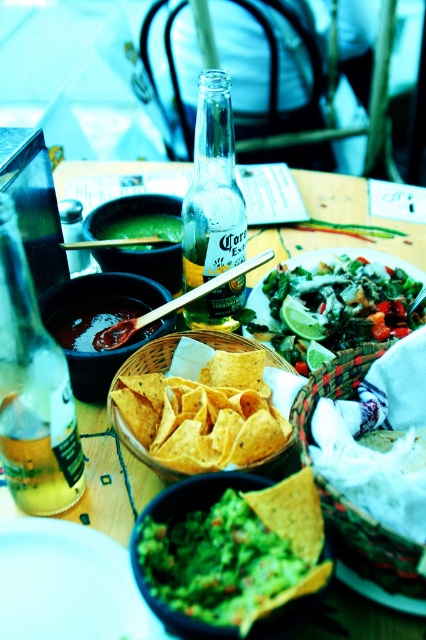
Question: Which object is closer to the camera taking this photo?

Choices:
 (A) braided straw basket at center
 (B) green creamy guacamole at center

Answer: (B)

Question: Is braided straw basket at center below matte green bowl at center?

Choices:
 (A) yes
 (B) no

Answer: (A)

Question: Is braided straw basket at center closer to camera compared to green matte lime at center?

Choices:
 (A) yes
 (B) no

Answer: (A)

Question: Which point is farther from the camera taking this photo?

Choices:
 (A) (178, 241)
 (B) (150, 205)
 (C) (420, 579)
 (D) (293, 296)

Answer: (B)

Question: Estimate the real-world distances between objects in this image. Which object is farther from the matte yellow tortilla chips at center?

Choices:
 (A) green matte guacamole at center
 (B) translucent glass bottle at left

Answer: (B)

Question: Observing the image, what is the correct spatial positioning of matte yellow tortilla chips at center in reference to green creamy guacamole at center?

Choices:
 (A) right
 (B) left

Answer: (A)